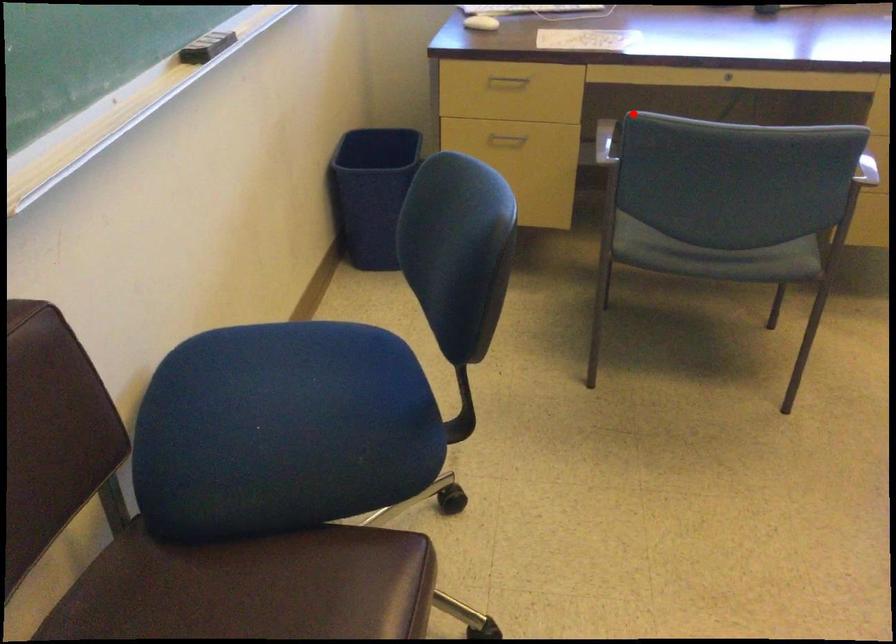
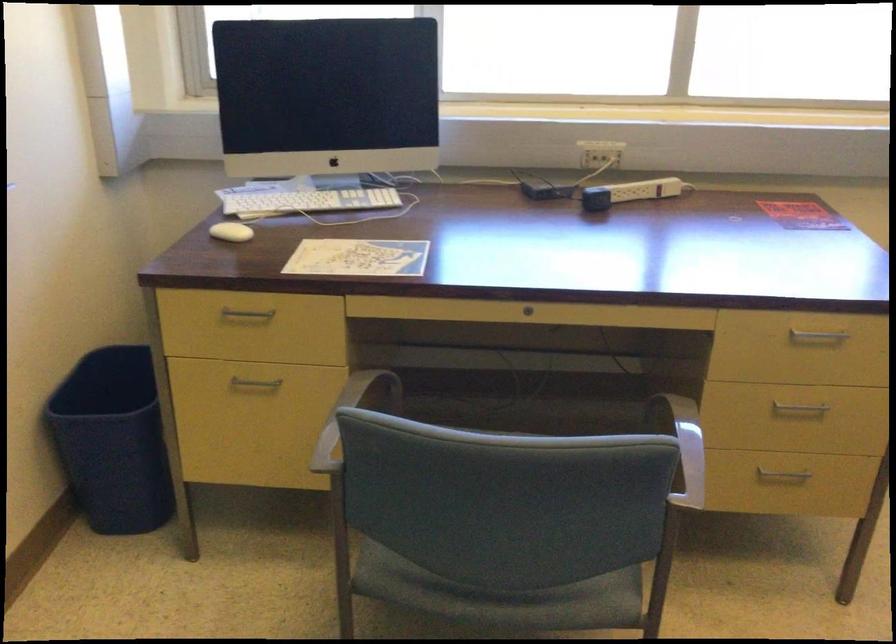
Locate, in the second image, the point that corresponds to the highlighted location in the first image.

(350, 415)